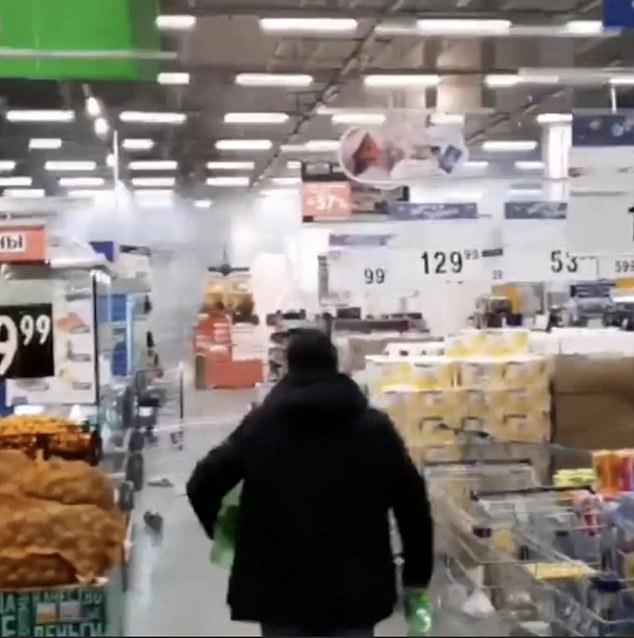
Locate an element on the screen. This screenshot has width=634, height=638. ceiling is located at coordinates (333, 56).